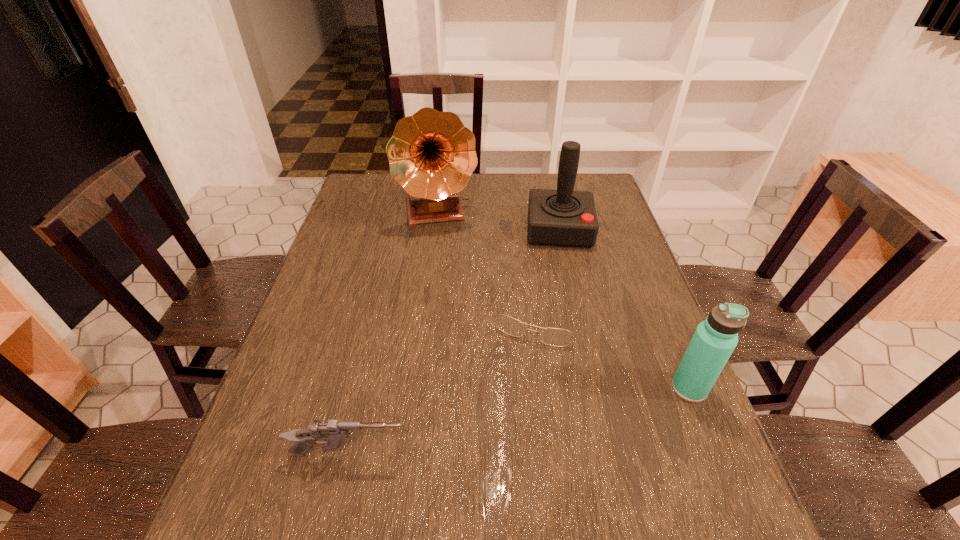
Find the location of a particular element. vacant spot on the desktop that is between the second shortest object and the thermos bottle and is positioned on the horn of the tallest object is located at coordinates (478, 429).

Where is `free spot on the desktop that is between the fourth tallest object and the rightmost object and is positioned on the front-facing side of the spectacles`? free spot on the desktop that is between the fourth tallest object and the rightmost object and is positioned on the front-facing side of the spectacles is located at coordinates (505, 424).

Where is `vacant space on the desktop that is between the second shortest object and the rightmost object and is positioned on the base of the joystick`? This screenshot has height=540, width=960. vacant space on the desktop that is between the second shortest object and the rightmost object and is positioned on the base of the joystick is located at coordinates (571, 411).